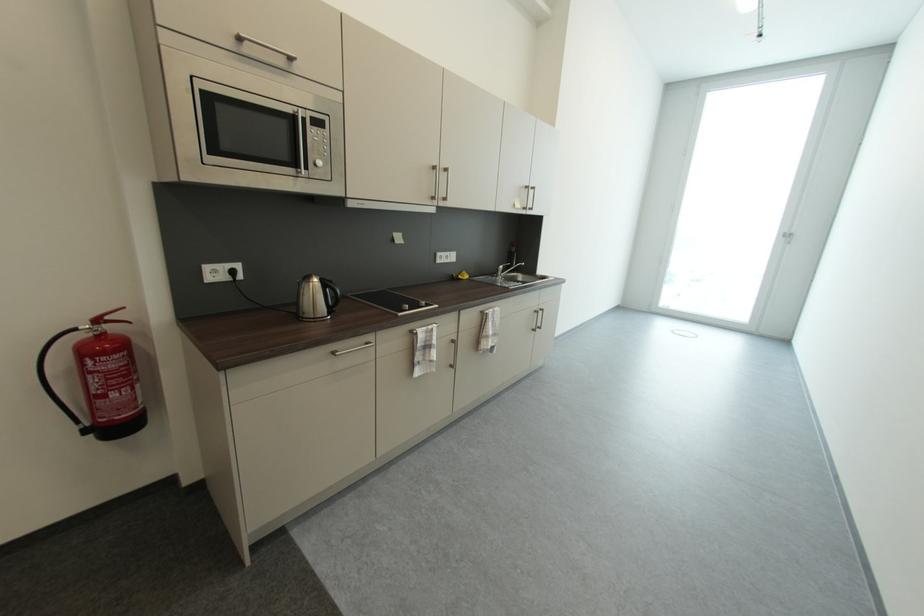
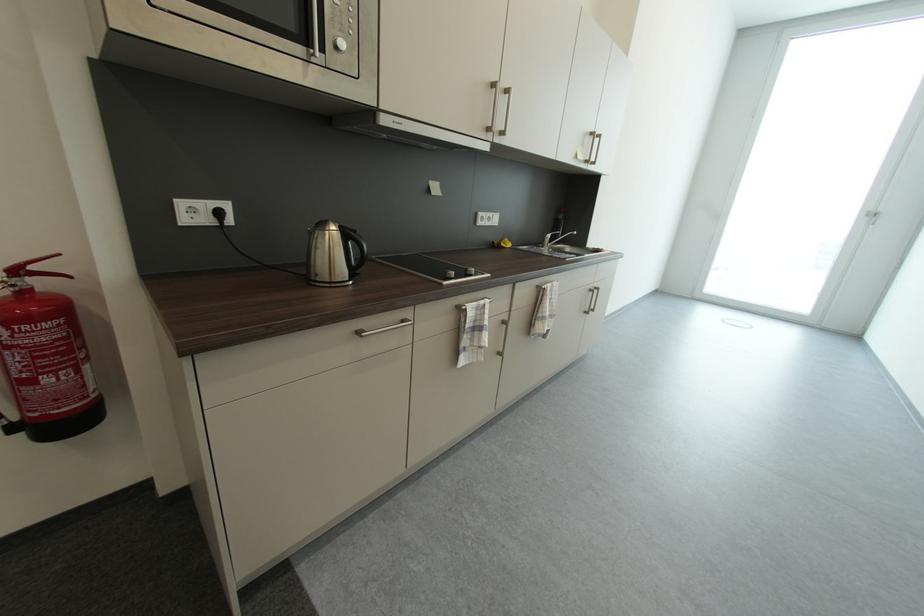
Locate, in the second image, the point that corresponds to [541,313] in the first image.

(598, 292)